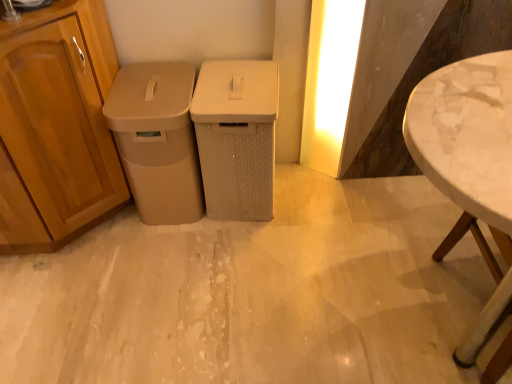
Find the location of `vacant area that lies between white marble table at right and beige matte trash can at left, which appears as the 2th waste container when viewed from the right`. vacant area that lies between white marble table at right and beige matte trash can at left, which appears as the 2th waste container when viewed from the right is located at coordinates (319, 260).